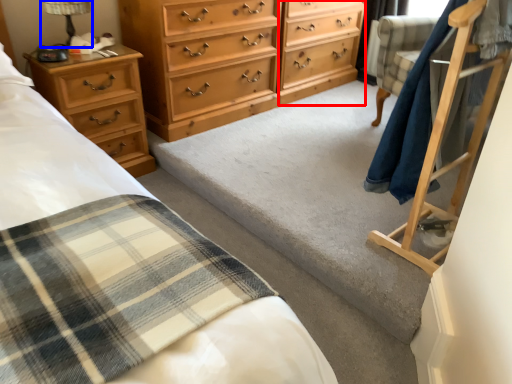
Question: Which of the following is the farthest to the observer, file cabinet (highlighted by a red box) or table lamp (highlighted by a blue box)?

Choices:
 (A) file cabinet
 (B) table lamp

Answer: (A)